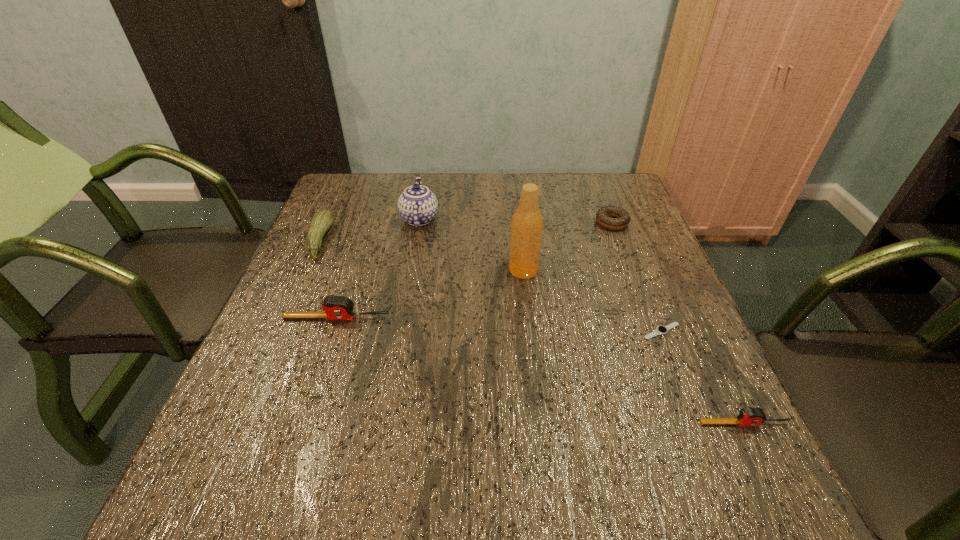
At what (x,y) coordinates should I click in order to perform the action: click on vacant space situated on the right of the left tape measure. Please return your answer as a coordinate pair (x, y). This screenshot has height=540, width=960. Looking at the image, I should click on (571, 318).

The height and width of the screenshot is (540, 960). Identify the location of vacant area located on the left of the shorter tape measure. (643, 423).

You are a GUI agent. You are given a task and a screenshot of the screen. Output one action in this format:
    pyautogui.click(x=<x>, y=<y>)
    Task: Click on the blank space located at the spout of the chinaware
    
    Given the screenshot: What is the action you would take?
    pyautogui.click(x=543, y=219)

This screenshot has height=540, width=960. I want to click on vacant space located on the left of the doughnut, so click(x=555, y=222).

Locate an element on the screen. This screenshot has height=540, width=960. free region located 0.270m at the stem end of the zucchini is located at coordinates (433, 241).

This screenshot has width=960, height=540. Find the location of `free space located on the front of the shortest object`. free space located on the front of the shortest object is located at coordinates (691, 405).

Locate an element on the screen. The height and width of the screenshot is (540, 960). free space located on the back of the beer bottle is located at coordinates (516, 203).

Find the location of a particular element. chinaware at the far edge is located at coordinates (417, 205).

Locate an element on the screen. The height and width of the screenshot is (540, 960). doughnut at the far edge is located at coordinates (604, 215).

Identify the location of object located at the near edge. (749, 416).